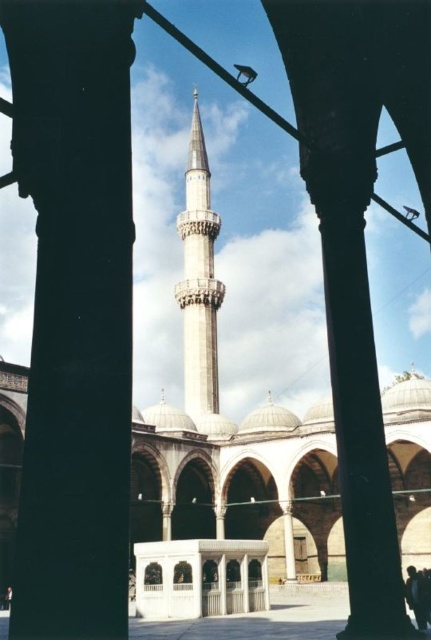
Question: Which point is farther to the camera?

Choices:
 (A) smooth stone pillar at center
 (B) dark hair at center

Answer: (B)

Question: Which object is closer to the camera taking this photo?

Choices:
 (A) smooth stone pillar at center
 (B) dark hair at center

Answer: (A)

Question: Can you confirm if smooth stone pillar at center is bigger than dark hair at center?

Choices:
 (A) yes
 (B) no

Answer: (B)

Question: Can you confirm if smooth stone pillar at center is bigger than white marble minaret at center?

Choices:
 (A) no
 (B) yes

Answer: (A)

Question: Does white marble minaret at center lie behind dark hair at center?

Choices:
 (A) yes
 (B) no

Answer: (A)

Question: Among these points, which one is nearest to the camera?

Choices:
 (A) (421, 625)
 (B) (206, 157)

Answer: (A)